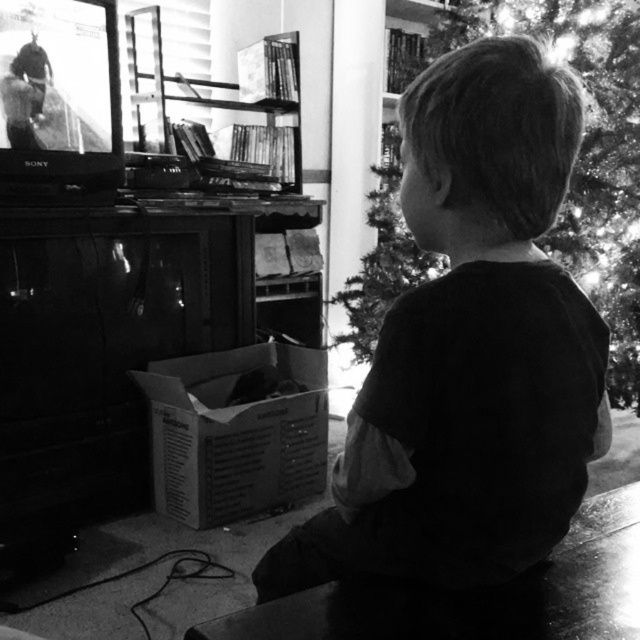
Question: Does dark cotton shirt at center have a larger size compared to shiny metallic tree at center?

Choices:
 (A) no
 (B) yes

Answer: (A)

Question: Does dark cotton shirt at center appear under shiny metallic tree at center?

Choices:
 (A) no
 (B) yes

Answer: (B)

Question: Is dark cotton shirt at center smaller than shiny metallic tree at center?

Choices:
 (A) yes
 (B) no

Answer: (A)

Question: Which of the following is the closest to the observer?

Choices:
 (A) (406, 474)
 (B) (609, 67)

Answer: (A)

Question: Which point is closer to the camera?

Choices:
 (A) (625, 396)
 (B) (536, 381)

Answer: (B)

Question: Among these objects, which one is farthest from the camera?

Choices:
 (A) shiny metallic tree at center
 (B) dark cotton shirt at center

Answer: (A)